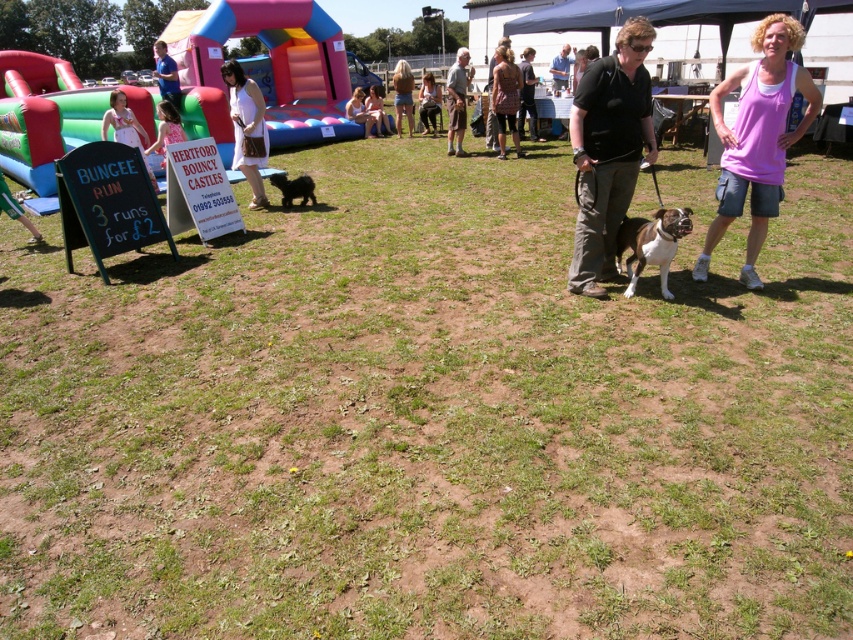
Question: Can you confirm if brown textured dress at center is positioned below matte white dress at center?

Choices:
 (A) yes
 (B) no

Answer: (A)

Question: Can you confirm if matte white dress at center is smaller than blue shirt at center?

Choices:
 (A) no
 (B) yes

Answer: (B)

Question: Which point is farther to the camera?

Choices:
 (A) (418, 115)
 (B) (160, 145)
 (C) (376, 129)
 (D) (402, 81)

Answer: (A)

Question: Which is nearer to the brown textured dress at center?

Choices:
 (A) matte black jacket at center
 (B) black fur dog at center
 (C) white fabric dress at center
 (D) black fabric shirt at center

Answer: (A)

Question: Considering the relative positions of brown textured dress at center and matte black jacket at center in the image provided, where is brown textured dress at center located with respect to matte black jacket at center?

Choices:
 (A) above
 (B) below

Answer: (B)

Question: Which object is farther from the camera taking this photo?

Choices:
 (A) gray fabric shorts at center
 (B) matte white tank top at center
 (C) matte white dress at center

Answer: (B)